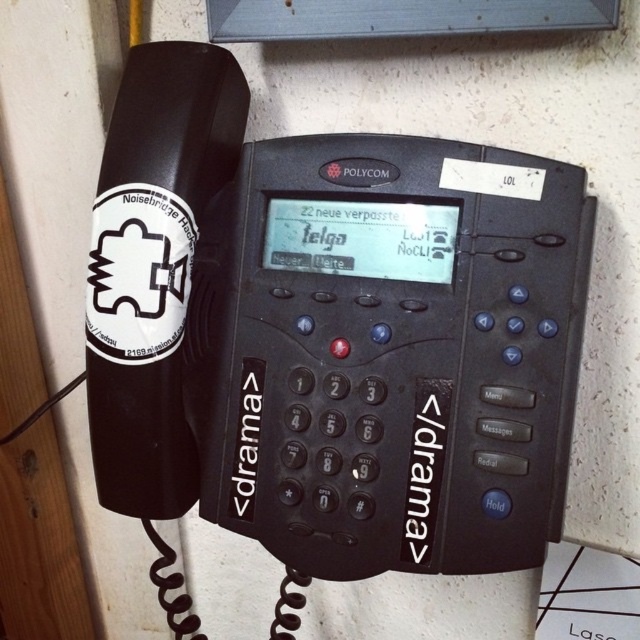
Can you confirm if black plastic phone at center is wider than white sticker at left?

Yes, black plastic phone at center is wider than white sticker at left.

Does black plastic phone at center have a smaller size compared to white sticker at left?

No.

The image size is (640, 640). In order to click on black plastic phone at center in this screenshot , I will do `click(330, 332)`.

The image size is (640, 640). In order to click on black plastic phone at center in this screenshot , I will do `click(330, 332)`.